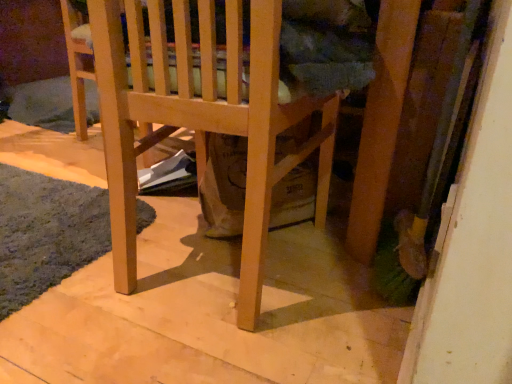
Question: Does soft gray carpet at lower left have a greater width compared to natural wood chair at center?

Choices:
 (A) yes
 (B) no

Answer: (B)

Question: Does soft gray carpet at lower left have a larger size compared to natural wood chair at center?

Choices:
 (A) yes
 (B) no

Answer: (B)

Question: Is soft gray carpet at lower left oriented away from natural wood chair at center?

Choices:
 (A) yes
 (B) no

Answer: (B)

Question: Are soft gray carpet at lower left and natural wood chair at center located far from each other?

Choices:
 (A) no
 (B) yes

Answer: (A)

Question: Does soft gray carpet at lower left contain natural wood chair at center?

Choices:
 (A) yes
 (B) no

Answer: (B)

Question: Is soft gray carpet at lower left smaller than natural wood chair at center?

Choices:
 (A) no
 (B) yes

Answer: (B)

Question: Does natural wood chair at center have a greater width compared to soft gray carpet at lower left?

Choices:
 (A) yes
 (B) no

Answer: (A)

Question: Is natural wood chair at center facing away from soft gray carpet at lower left?

Choices:
 (A) yes
 (B) no

Answer: (B)

Question: From the image's perspective, is natural wood chair at center on soft gray carpet at lower left?

Choices:
 (A) yes
 (B) no

Answer: (A)

Question: Considering the relative sizes of natural wood chair at center and soft gray carpet at lower left in the image provided, is natural wood chair at center shorter than soft gray carpet at lower left?

Choices:
 (A) no
 (B) yes

Answer: (A)

Question: From a real-world perspective, does natural wood chair at center stand above soft gray carpet at lower left?

Choices:
 (A) yes
 (B) no

Answer: (A)

Question: Is natural wood chair at center positioned far away from soft gray carpet at lower left?

Choices:
 (A) no
 (B) yes

Answer: (A)

Question: Is natural wood chair at center spatially inside soft gray carpet at lower left, or outside of it?

Choices:
 (A) inside
 (B) outside

Answer: (B)